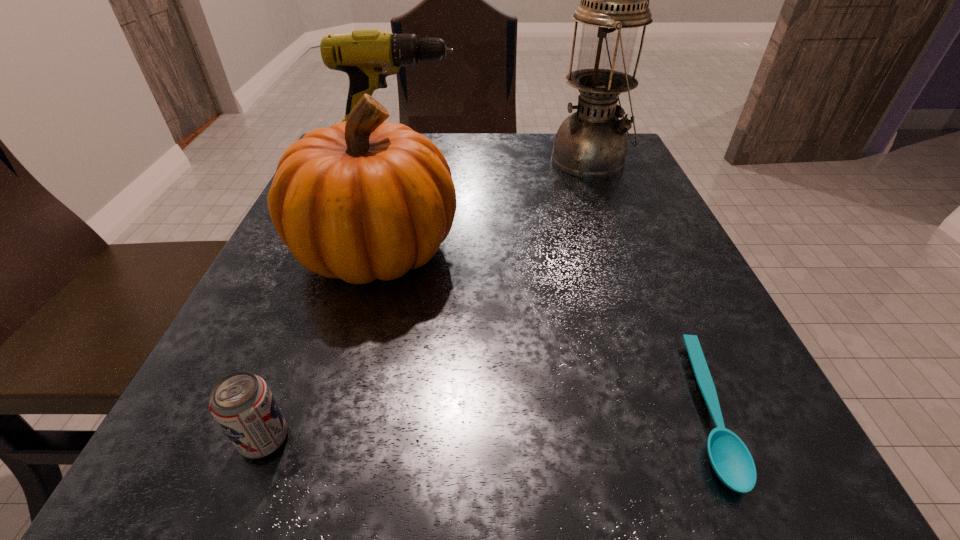
Locate an element on the screen. vacant space in between the beer can and the spoon is located at coordinates [484, 424].

Identify the location of vacant point located between the oil lamp and the shortest object. Image resolution: width=960 pixels, height=540 pixels. (647, 285).

Where is `free point between the pumpkin and the shortest object`? Image resolution: width=960 pixels, height=540 pixels. free point between the pumpkin and the shortest object is located at coordinates (540, 329).

The width and height of the screenshot is (960, 540). I want to click on vacant space in between the drill and the spoon, so click(x=552, y=283).

At what (x,y) coordinates should I click in order to perform the action: click on free space between the beer can and the spoon. Please return your answer as a coordinate pair (x, y). The height and width of the screenshot is (540, 960). Looking at the image, I should click on (484, 424).

Locate an element on the screen. vacant area between the drill and the tallest object is located at coordinates (495, 158).

At what (x,y) coordinates should I click in order to perform the action: click on vacant space that's between the beer can and the drill. Please return your answer as a coordinate pair (x, y). Looking at the image, I should click on (332, 298).

You are a GUI agent. You are given a task and a screenshot of the screen. Output one action in this format:
    pyautogui.click(x=<x>, y=<y>)
    Task: Click on the empty space that is in between the fourth tallest object and the drill
    
    Given the screenshot: What is the action you would take?
    pyautogui.click(x=332, y=298)

Where is `empty location between the drill and the second shortest object`? The image size is (960, 540). empty location between the drill and the second shortest object is located at coordinates (332, 298).

In order to click on free space that is in between the shortest object and the drill in this screenshot , I will do `click(552, 283)`.